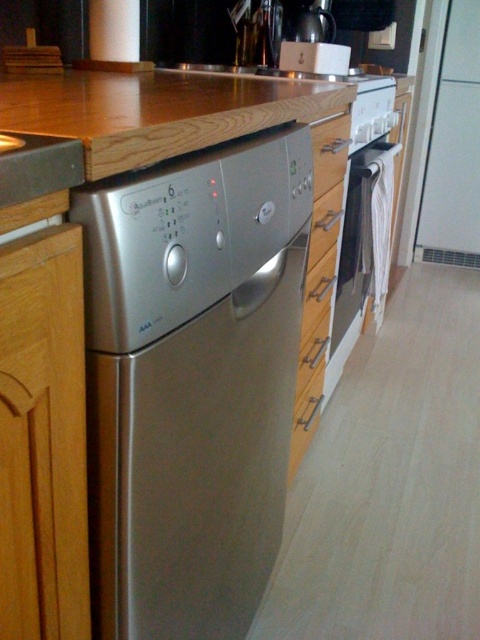
You are standing in the kitchen and want to reach the point at coordinates (274,198). The distance between you and this point is 34.38 inches. If your arm can extend 30 inches, can you comfortably reach this point without moving closer?

The distance between you and the point is 34.38 inches, which is slightly more than your arm can extend by 4.38 inches. Therefore, you cannot comfortably reach the point without moving closer.

You are a delivery person trying to place a new dishwasher in the kitchen. The dishwasher must be placed at point (355,180). You are currently 2 meters away from that point. Can you move closer to the point without exceeding the required distance?

The distance between point (355,180) and the camera is 1.72 meters. Since you are currently 2 meters away, you can move closer to reach the required placement point as 2 meters is greater than 1.72 meters.

You are a kitchen designer arranging items in the kitchen. You have a white glossy oven at right and a brushed metal drawer at center. Which one is more to the right?

The white glossy oven at right is more to the right because it is positioned on the right side of the brushed metal drawer at center.